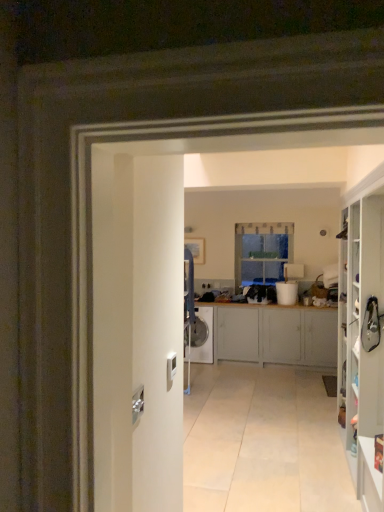
Question: Looking at the image, does clear glass window at center seem bigger or smaller compared to white glossy washing machine at center?

Choices:
 (A) big
 (B) small

Answer: (B)

Question: Looking at their shapes, would you say clear glass window at center is wider or thinner than white glossy washing machine at center?

Choices:
 (A) wide
 (B) thin

Answer: (B)

Question: Which object is positioned closest to the white glossy washing machine at center?

Choices:
 (A) matte gray cabinet at center, positioned as the 2th cabinetry in front-to-back order
 (B) clear glass window at center
 (C) white glossy cabinet at right, which is the first cabinetry in front-to-back order

Answer: (A)

Question: Estimate the real-world distances between objects in this image. Which object is farther from the white glossy washing machine at center?

Choices:
 (A) clear glass window at center
 (B) matte gray cabinet at center, which is counted as the 1th cabinetry, starting from the back
 (C) white glossy cabinet at right, the second cabinetry viewed from the back

Answer: (C)